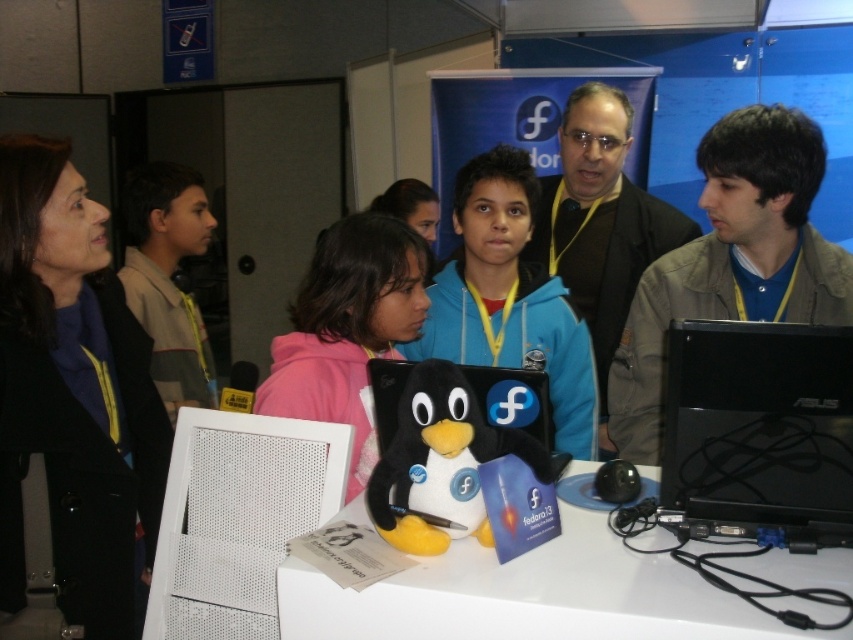
You are organizing a booth at a tech event and need to hang two jackets on a rack. The rack has a maximum width capacity of 1.2 meters. You have the matte black jacket at left and the blue fleece jacket at center. Can both jackets be hung side by side on the rack without exceeding the width limit?

The matte black jacket at left is narrower than the blue fleece jacket at center. To determine if both can fit, add their widths. However, since the exact widths aren not provided, but the matte black jacket is narrower, if the combined width of both jackets is under 1.2 meters, they can be hung together. Without specific measurements, we can only confirm that the matte black jacket at left is narrower, but the total width must be manually checked.

You are a photographer standing in front of the white glossy table at center and the matte pink hoodie at center. You want to take a photo that focuses on the hoodie while keeping the table in the background. Which object should you position closer to the camera?

The matte pink hoodie at center should be positioned closer to the camera since it is the focus, while the white glossy table at center is already farther away and will naturally appear in the background.